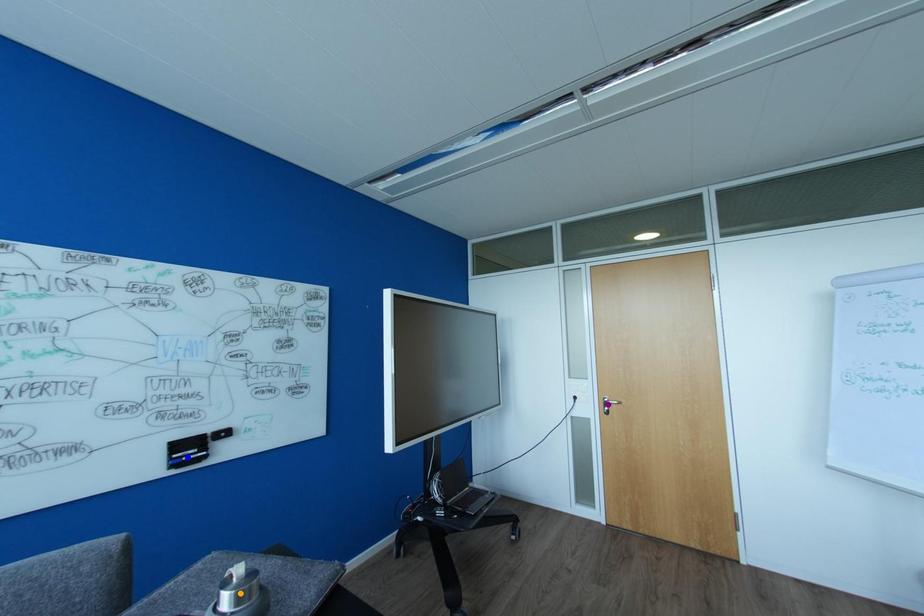
Order these from farthest to nearest:
blue point, purple point, orange point

purple point, blue point, orange point